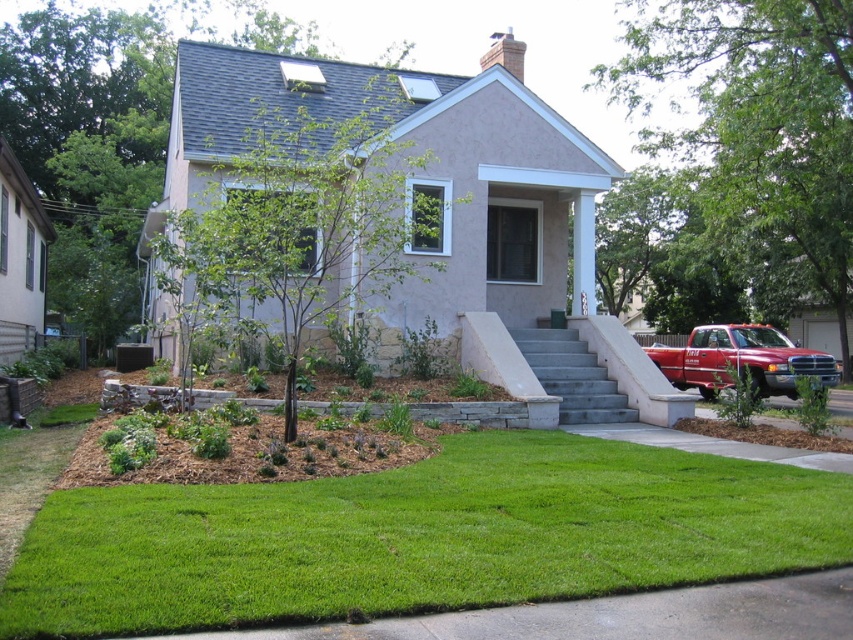
Question: Which object is the farthest from the green lawn at center?

Choices:
 (A) matte red truck at right
 (B) gray concrete stairs at center

Answer: (A)

Question: Among these points, which one is nearest to the camera?

Choices:
 (A) (54, 609)
 (B) (811, 355)
 (C) (608, 394)

Answer: (A)

Question: Is green lawn at center positioned behind gray concrete stairs at center?

Choices:
 (A) no
 (B) yes

Answer: (A)

Question: Does matte red truck at right have a lesser width compared to gray concrete stairs at center?

Choices:
 (A) yes
 (B) no

Answer: (B)

Question: Which point is closer to the camera?

Choices:
 (A) gray concrete stairs at center
 (B) matte red truck at right

Answer: (B)

Question: Does green lawn at center lie in front of matte red truck at right?

Choices:
 (A) no
 (B) yes

Answer: (B)